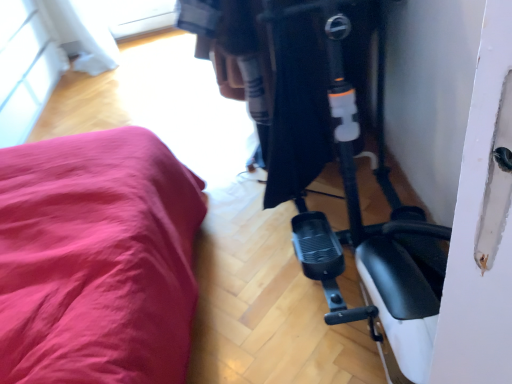
What do you see at coordinates (348, 178) in the screenshot? This screenshot has width=512, height=384. I see `white matte mobility scooter at center` at bounding box center [348, 178].

I want to click on white matte mobility scooter at center, so click(348, 178).

Image resolution: width=512 pixels, height=384 pixels. What are the coordinates of `white matte mobility scooter at center` in the screenshot? It's located at (348, 178).